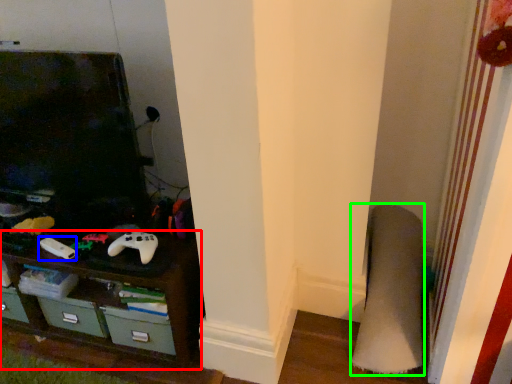
Question: Considering the real-world distances, which object is closest to shelf (highlighted by a red box)? game controller (highlighted by a blue box) or plain (highlighted by a green box).

Choices:
 (A) game controller
 (B) plain

Answer: (A)